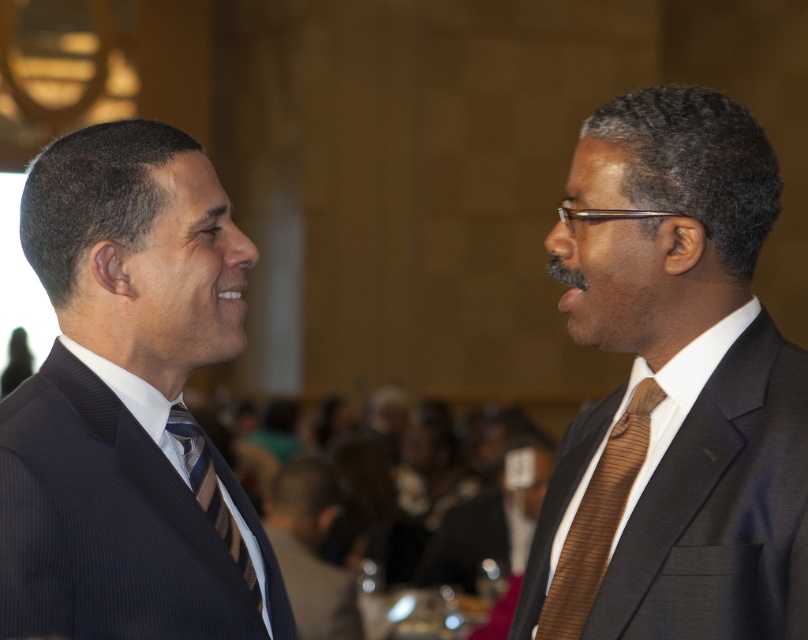
From the picture: Who is lower down, brown silk tie at center or striped fabric tie at left?

brown silk tie at center

The image size is (808, 640). Find the location of `brown silk tie at center`. brown silk tie at center is located at coordinates (490, 522).

Does brown textured tie at right appear over striped fabric tie at left?

Yes.

Can you confirm if brown textured tie at right is thinner than striped fabric tie at left?

No, brown textured tie at right is not thinner than striped fabric tie at left.

Between point (680, 145) and point (253, 579), which one is positioned in front?

Point (680, 145) is more forward.

The width and height of the screenshot is (808, 640). I want to click on brown textured tie at right, so click(672, 388).

Can you confirm if brown textured suit at center is shorter than striped fabric tie at left?

No, brown textured suit at center is not shorter than striped fabric tie at left.

This screenshot has height=640, width=808. Find the location of `brown textured suit at center`. brown textured suit at center is located at coordinates (310, 548).